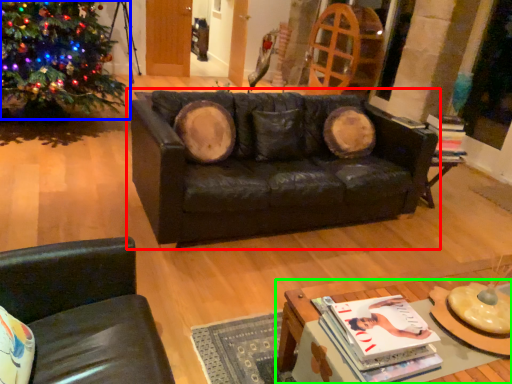
Question: Based on their relative distances, which object is farther from studio couch (highlighted by a red box)? Choose from christmas tree (highlighted by a blue box) and table (highlighted by a green box).

Choices:
 (A) christmas tree
 (B) table

Answer: (A)